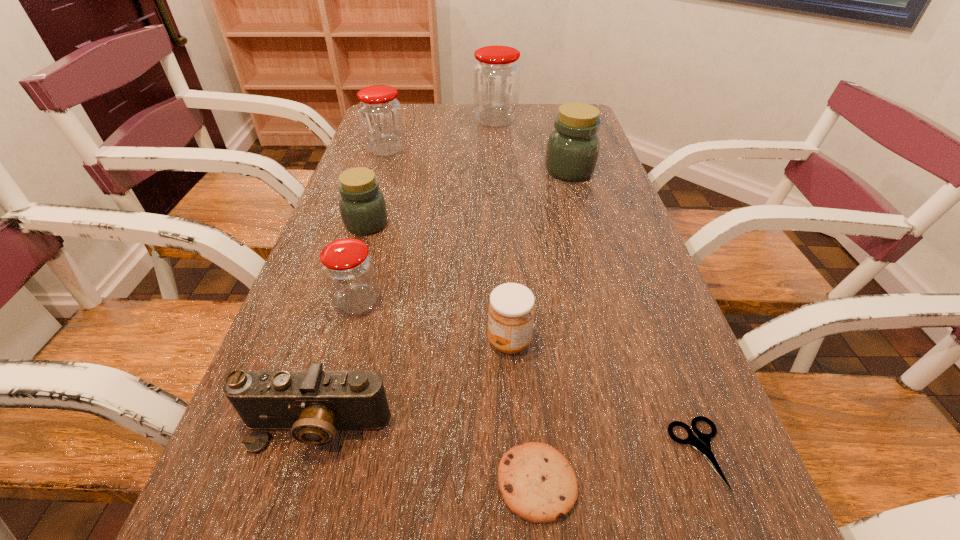
Locate an element on the screen. The width and height of the screenshot is (960, 540). orange jam is located at coordinates (511, 309).

Find the location of a particular element. This screenshot has height=540, width=960. camera is located at coordinates (313, 404).

This screenshot has width=960, height=540. In order to click on the second shortest object in this screenshot , I will do `click(537, 482)`.

The image size is (960, 540). Find the location of `the shortest object`. the shortest object is located at coordinates (702, 443).

I want to click on free space located on the left of the farthest jar, so click(x=416, y=120).

Locate an element on the screen. Image resolution: width=960 pixels, height=540 pixels. free spot located on the back of the rightmost jar is located at coordinates (554, 120).

Locate an element on the screen. vacant area situated 0.330m on the right of the second farthest red jar is located at coordinates (512, 150).

Identify the location of vacant space located on the front of the smaller green jar. (347, 288).

Identify the location of free region located on the front of the nearest jar. The height and width of the screenshot is (540, 960). (307, 483).

Locate an element on the screen. The width and height of the screenshot is (960, 540). blank area located on the front label of the fourth nearest object is located at coordinates (299, 341).